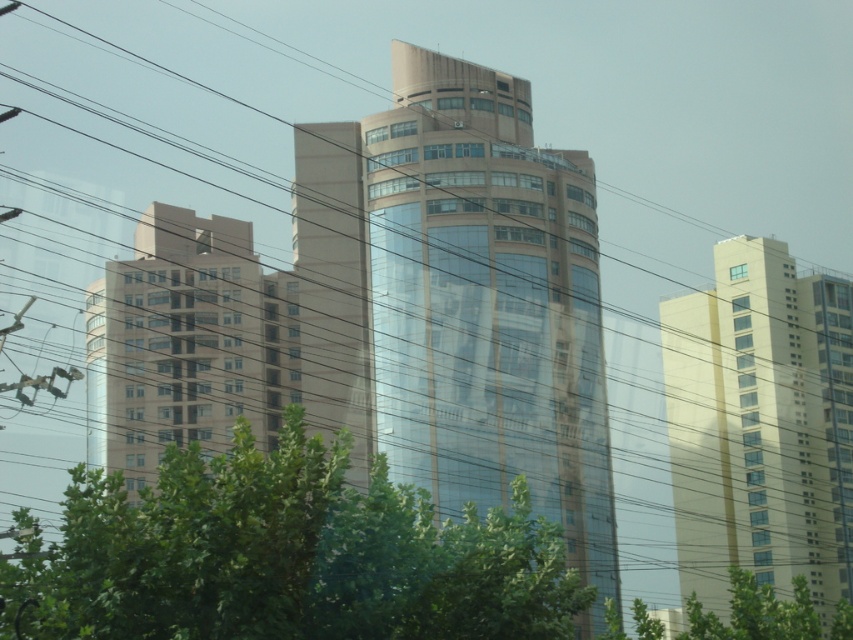
Question: Considering the real-world distances, which object is farthest from the yellow/golden glass building at right?

Choices:
 (A) green leafy tree at center
 (B) matte glass building at center

Answer: (A)

Question: Is matte glass building at center thinner than yellow/golden glass building at right?

Choices:
 (A) yes
 (B) no

Answer: (B)

Question: Is the position of matte glass building at center less distant than that of green leafy tree at center?

Choices:
 (A) no
 (B) yes

Answer: (A)

Question: Is green leafy tree at center thinner than yellow/golden glass building at right?

Choices:
 (A) no
 (B) yes

Answer: (B)

Question: Among these objects, which one is farthest from the camera?

Choices:
 (A) yellow/golden glass building at right
 (B) green leafy tree at center
 (C) matte glass building at center

Answer: (A)

Question: Which point is closer to the camera taking this photo?

Choices:
 (A) (445, 150)
 (B) (785, 548)
 (C) (511, 545)

Answer: (C)